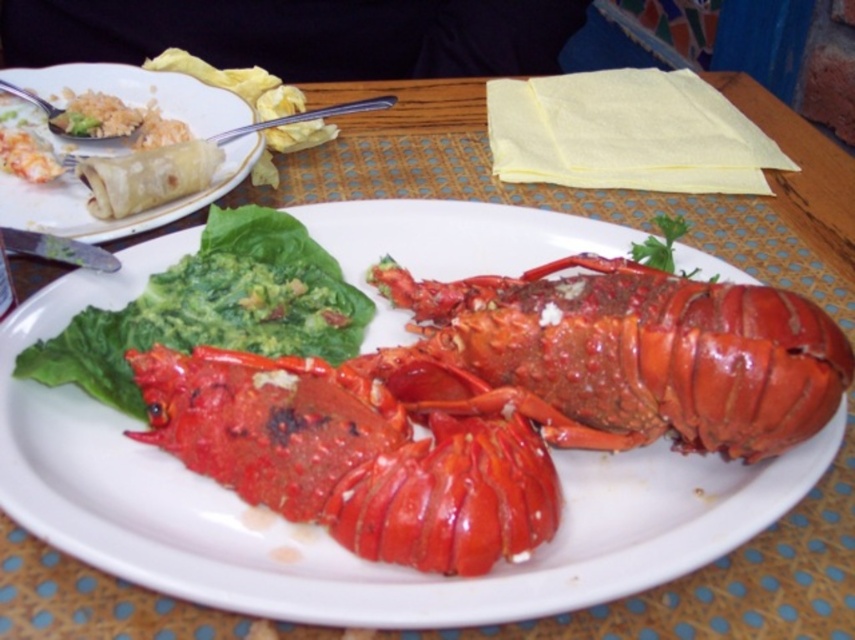
Who is more forward, (x=87, y=228) or (x=134, y=204)?

Point (x=87, y=228) is in front.

Does matte brown spring roll at upper left have a larger size compared to matte tortilla at left?

Indeed, matte brown spring roll at upper left has a larger size compared to matte tortilla at left.

Is point (40, 84) behind point (205, 188)?

Yes, point (40, 84) is behind point (205, 188).

Where is `matte brown spring roll at upper left`? matte brown spring roll at upper left is located at coordinates (111, 220).

Who is higher up, green leafy at center or matte brown spring roll at upper left?

matte brown spring roll at upper left is above.

Which is more to the left, green leafy at center or matte brown spring roll at upper left?

From the viewer's perspective, matte brown spring roll at upper left appears more on the left side.

The image size is (855, 640). Describe the element at coordinates (213, 308) in the screenshot. I see `green leafy at center` at that location.

Identify the location of green leafy at center. (213, 308).

Looking at this image, which of these two, shiny red lobster at center or matte tortilla at left, stands shorter?

With less height is matte tortilla at left.

Between shiny red lobster at center and matte tortilla at left, which one appears on the left side from the viewer's perspective?

From the viewer's perspective, matte tortilla at left appears more on the left side.

Is point (128, 474) closer to viewer compared to point (152, 193)?

Yes, it is.

Where is `shiny red lobster at center`? shiny red lobster at center is located at coordinates coord(323,532).